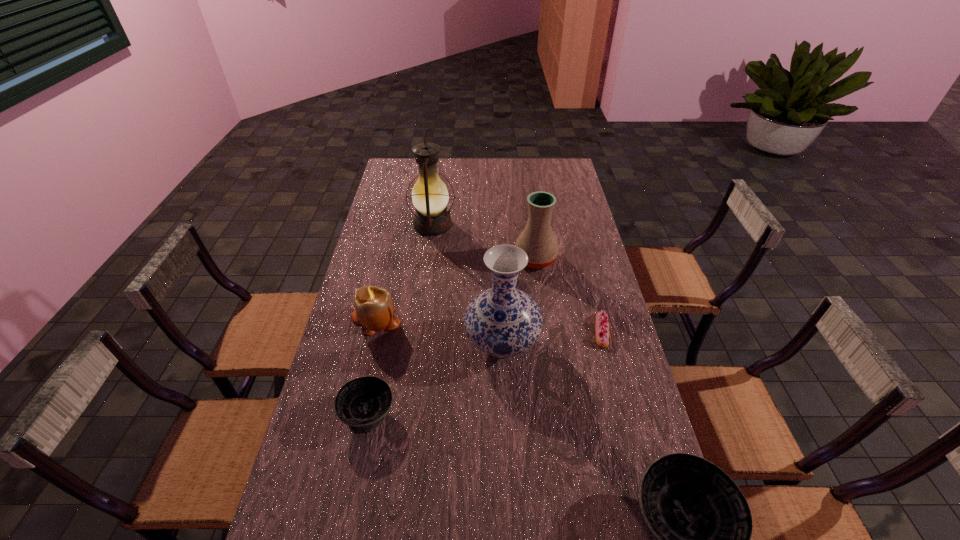
The width and height of the screenshot is (960, 540). What are the coordinates of `free region located 0.100m on the front of the third tallest object` in the screenshot? It's located at (540, 293).

The image size is (960, 540). In order to click on vacant space located on the front of the shortest object in this screenshot , I will do `click(611, 363)`.

The width and height of the screenshot is (960, 540). What are the coordinates of `vacant space located 0.390m on the front of the vase` in the screenshot? It's located at (510, 518).

The image size is (960, 540). I want to click on free space located on the right of the fourth tallest object, so click(426, 319).

The width and height of the screenshot is (960, 540). Identify the location of bowl located at the left edge. (362, 403).

The image size is (960, 540). What are the coordinates of `oil lamp that is positioned at the left edge` in the screenshot? It's located at (430, 197).

You are a GUI agent. You are given a task and a screenshot of the screen. Output one action in this format:
    pyautogui.click(x=<x>, y=<y>)
    Task: Click on the candle situated at the left edge
    
    Given the screenshot: What is the action you would take?
    374,309

The width and height of the screenshot is (960, 540). I want to click on pottery positioned at the right edge, so click(x=537, y=239).

Where is `eclair that is at the right edge`? The image size is (960, 540). eclair that is at the right edge is located at coordinates (602, 334).

In the image, there is a desktop. Where is `vacant area at the far edge`? The height and width of the screenshot is (540, 960). vacant area at the far edge is located at coordinates tap(502, 174).